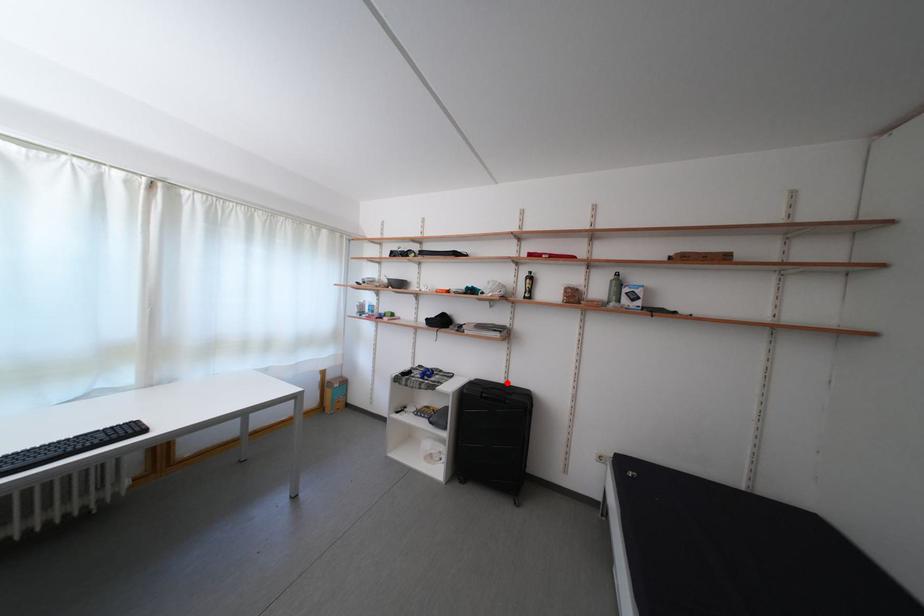
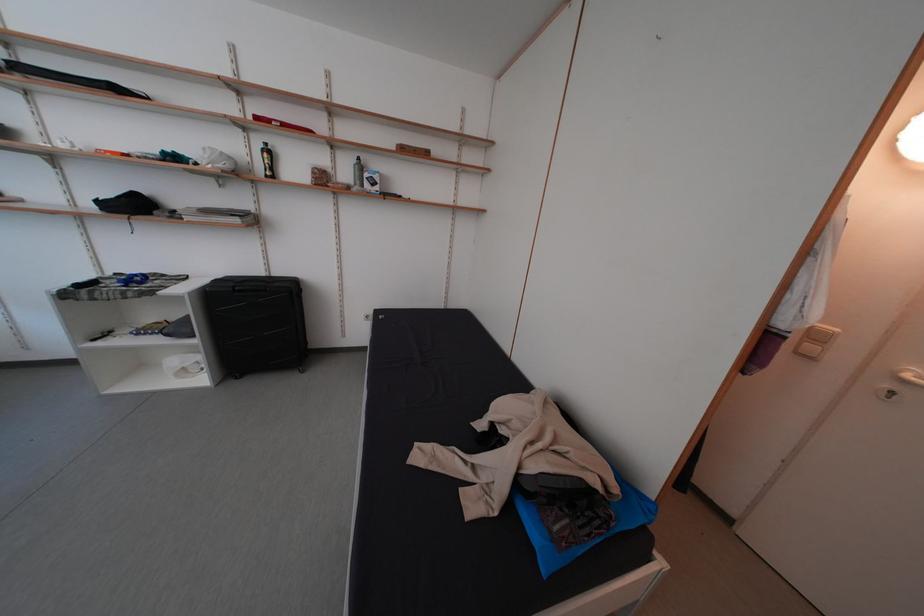
Question: I am providing you with two images of the same scene from different viewpoints. A red point is shown in image1. For the corresponding object point in image2, is it positioned nearer or farther from the camera?

Choices:
 (A) Nearer
 (B) Farther

Answer: (A)